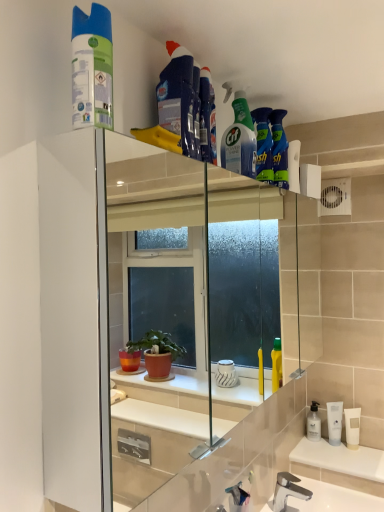
Question: Does point (281, 505) appear closer or farther from the camera than point (188, 150)?

Choices:
 (A) farther
 (B) closer

Answer: (A)

Question: Would you say polished chrome faucet at lower center is inside or outside blue fabric cleaning product at upper center, marked as the 4th cleaning product in a right-to-left arrangement?

Choices:
 (A) inside
 (B) outside

Answer: (B)

Question: Based on their relative distances, which object is farther from the blue fabric cleaning product at upper center, which ranks as the third cleaning product in front-to-back order?

Choices:
 (A) polished chrome faucet at lower center
 (B) green matte spray bottle at upper center, acting as the second cleaning product starting from the back
 (C) blue glossy bottle at upper center, marked as the first cleaning product in a right-to-left arrangement
 (D) green matte spray can at upper left, positioned as the 1th cleaning product in front-to-back order
 (E) blue fabric cleaning product at upper center, which appears as the fourth cleaning product when viewed from the back

Answer: (A)

Question: Which is nearer to the green matte spray can at upper left, arranged as the 5th cleaning product when viewed from the right?

Choices:
 (A) blue fabric cleaning product at upper center, which appears as the third cleaning product when viewed from the back
 (B) blue fabric cleaning product at upper center, which appears as the second cleaning product when viewed from the left
 (C) polished chrome faucet at lower center
 (D) blue glossy bottle at upper center, marked as the first cleaning product in a right-to-left arrangement
 (E) green matte spray bottle at upper center, the 2th cleaning product positioned from the right

Answer: (B)